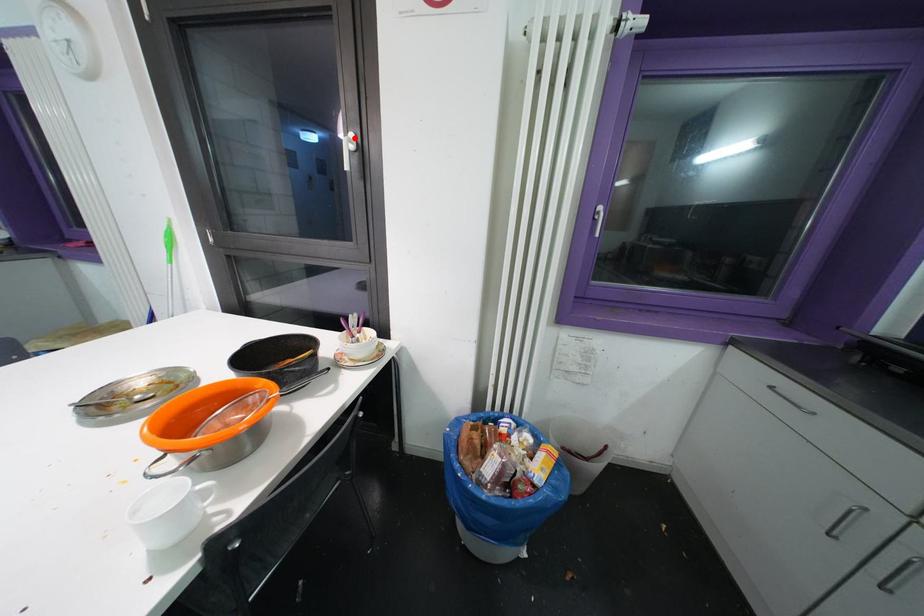
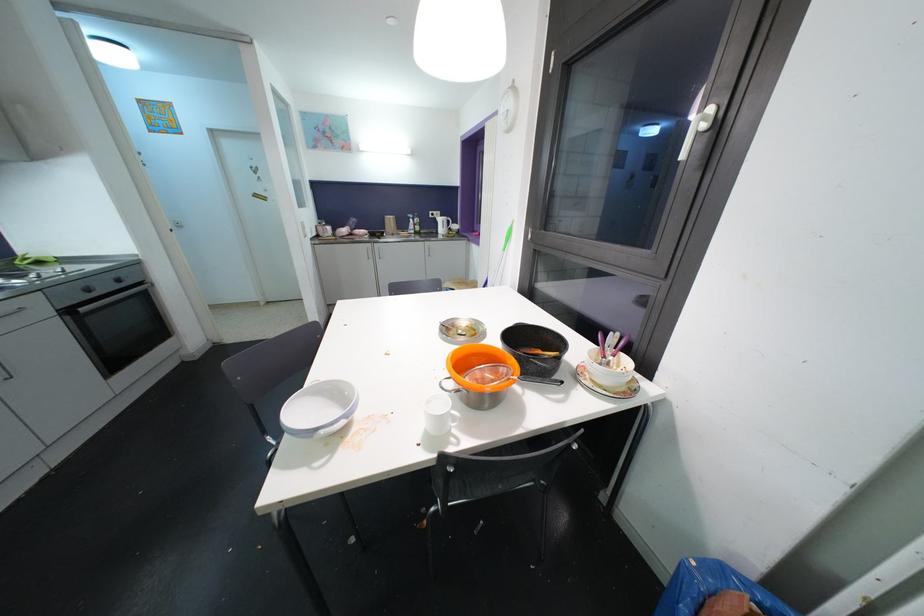
Where in the second image is the point corresponding to the highlighted location from the first image?

(713, 111)